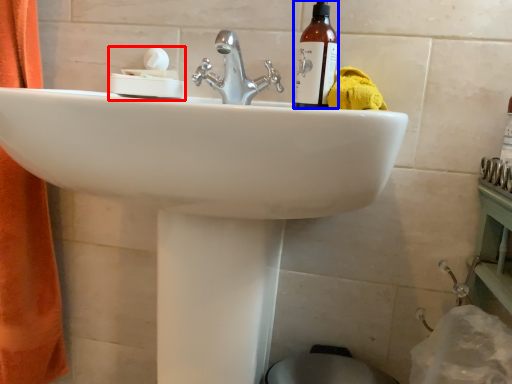
Question: Which object is closer to the camera taking this photo, tissue (highlighted by a red box) or bottle (highlighted by a blue box)?

Choices:
 (A) tissue
 (B) bottle

Answer: (B)